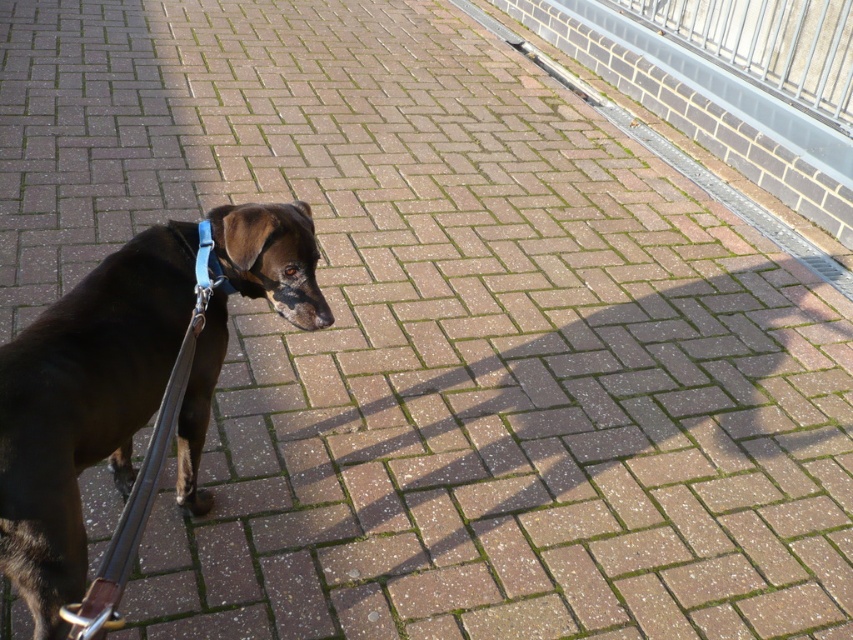
Does black leather dog at left have a lesser width compared to blue fabric strap at center?

No, black leather dog at left is not thinner than blue fabric strap at center.

Is point (33, 406) positioned after point (200, 243)?

No, (33, 406) is closer to viewer.

Where is `black leather dog at left`? The height and width of the screenshot is (640, 853). black leather dog at left is located at coordinates (84, 406).

The height and width of the screenshot is (640, 853). What are the coordinates of `black leather dog at left` in the screenshot? It's located at (84, 406).